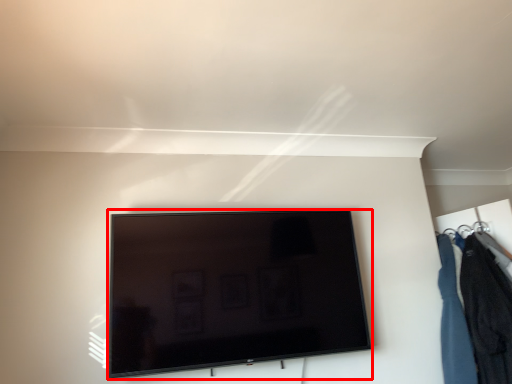
Question: From the image's perspective, where is television (annotated by the red box) located relative to closet?

Choices:
 (A) below
 (B) above

Answer: (B)